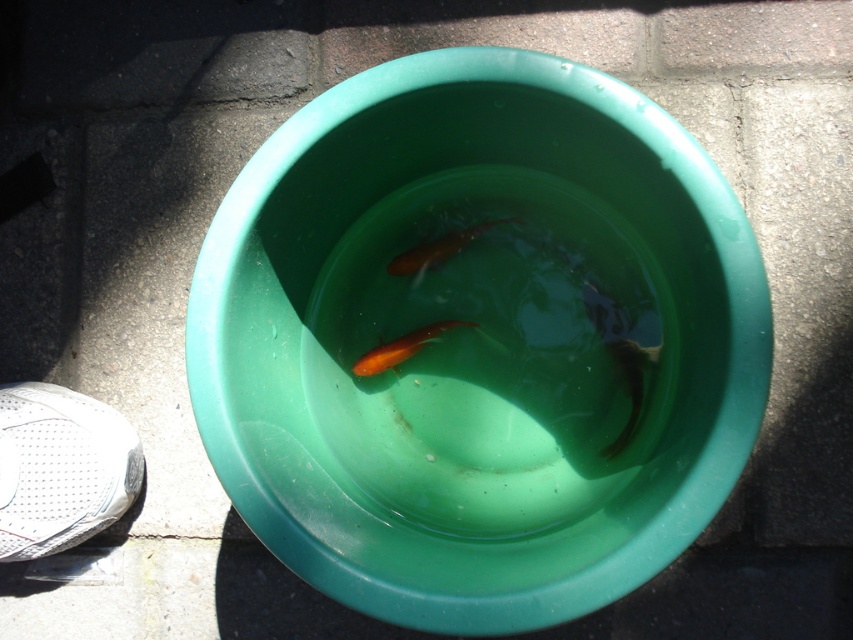
Is green plastic bowl at center bigger than orange glossy fish at center?

Yes.

Is green plastic bowl at center shorter than orange glossy fish at center?

No, green plastic bowl at center is not shorter than orange glossy fish at center.

Find the location of a particular element. green plastic bowl at center is located at coordinates (479, 340).

Does point (572, 355) lie in front of point (372, 355)?

Yes, it is.

Which of these two, green plastic bowl at center or orange glossy goldfish at center, stands taller?

green plastic bowl at center is taller.

Does point (279, 436) come closer to viewer compared to point (456, 324)?

That is True.

Find the location of a particular element. Image resolution: width=853 pixels, height=640 pixels. green plastic bowl at center is located at coordinates (479, 340).

Can you confirm if orange glossy fish at center is bigger than orange glossy goldfish at center?

No.

Who is lower down, orange glossy fish at center or orange glossy goldfish at center?

Positioned lower is orange glossy goldfish at center.

Is point (439, 252) positioned in front of point (392, 342)?

No, it is not.

Where is `orange glossy fish at center`? This screenshot has width=853, height=640. orange glossy fish at center is located at coordinates tap(437, 250).